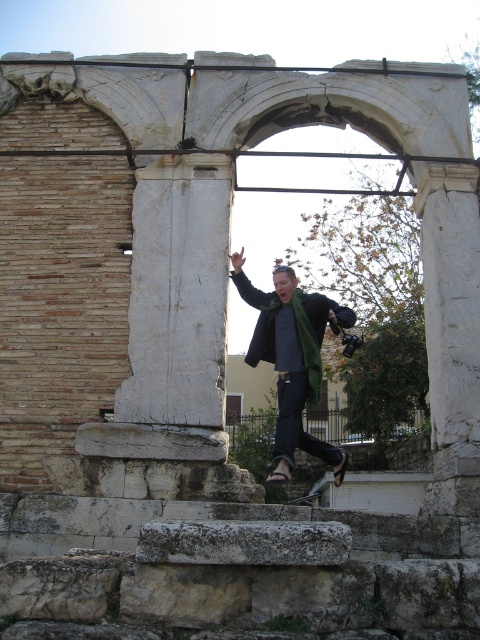
You are standing on the stone structure and want to take a photo of the white stone column at center. Where exactly should you position yourself to capture it in the frame?

The white stone column at center is located at point (178, 292), so you should position yourself directly in front of that coordinate to capture it in the frame.

You are a photographer trying to capture the white stone column at center and the green wool scarf at center in the same frame. Based on their sizes, which object will appear smaller in the photo?

The white stone column at center will appear smaller in the photo because its width is less than the green wool scarf at center.